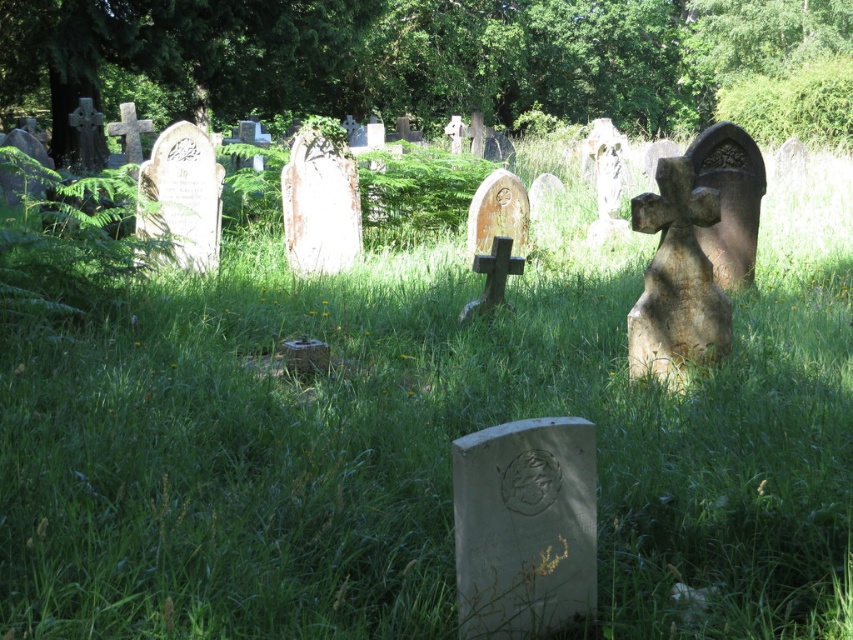
Question: Does green leafy tree at upper center appear under gray stone gravestone at center?

Choices:
 (A) no
 (B) yes

Answer: (A)

Question: Observing the image, what is the correct spatial positioning of green leafy tree at upper center in reference to gray stone gravestone at center?

Choices:
 (A) above
 (B) below

Answer: (A)

Question: Among these points, which one is nearest to the camera?

Choices:
 (A) (x=651, y=86)
 (B) (x=554, y=554)

Answer: (B)

Question: Which point is farther to the camera?

Choices:
 (A) gray stone gravestone at center
 (B) green leafy tree at upper center

Answer: (B)

Question: Can you confirm if green leafy tree at upper center is positioned above gray stone gravestone at center?

Choices:
 (A) yes
 (B) no

Answer: (A)